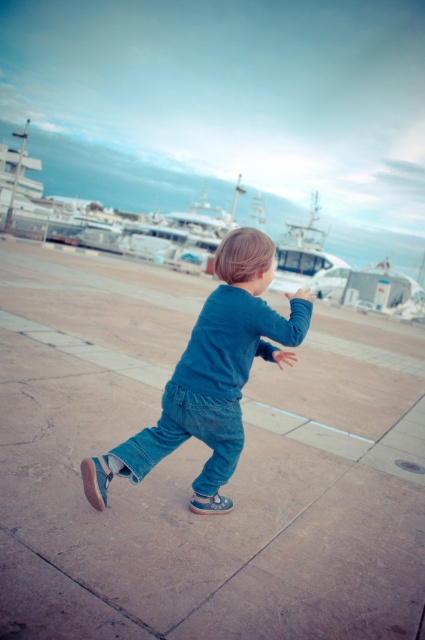
Question: Which of the following is the farthest from the observer?

Choices:
 (A) (204, 429)
 (B) (311, 579)

Answer: (A)

Question: Can you confirm if brown stone pavement at center is positioned above denim pants at center?

Choices:
 (A) yes
 (B) no

Answer: (B)

Question: Which point is farther from the camera taking this photo?

Choices:
 (A) (175, 484)
 (B) (311, 260)
 (C) (212, 378)

Answer: (B)

Question: Is brown stone pavement at center positioned at the back of white glossy boat at center?

Choices:
 (A) yes
 (B) no

Answer: (B)

Question: Which point is farther to the camera?

Choices:
 (A) denim pants at center
 (B) white glossy boat at center

Answer: (B)

Question: Is denim pants at center positioned in front of white glossy boat at center?

Choices:
 (A) yes
 (B) no

Answer: (A)